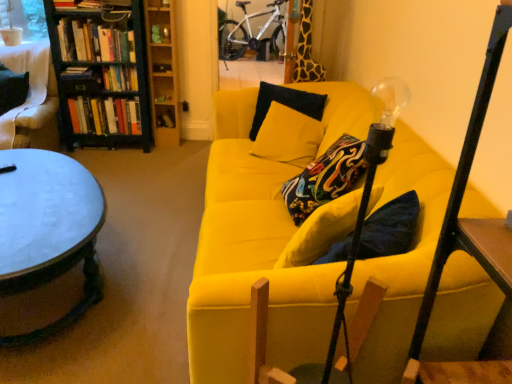
You are a GUI agent. You are given a task and a screenshot of the screen. Output one action in this format:
    pyautogui.click(x=<x>, y=<y>)
    Task: Click on the vacant region in front of wooden bookcase at upper center, which is the first bookcase in right-to-left order
    The image size is (512, 384).
    Given the screenshot: What is the action you would take?
    pyautogui.click(x=169, y=147)